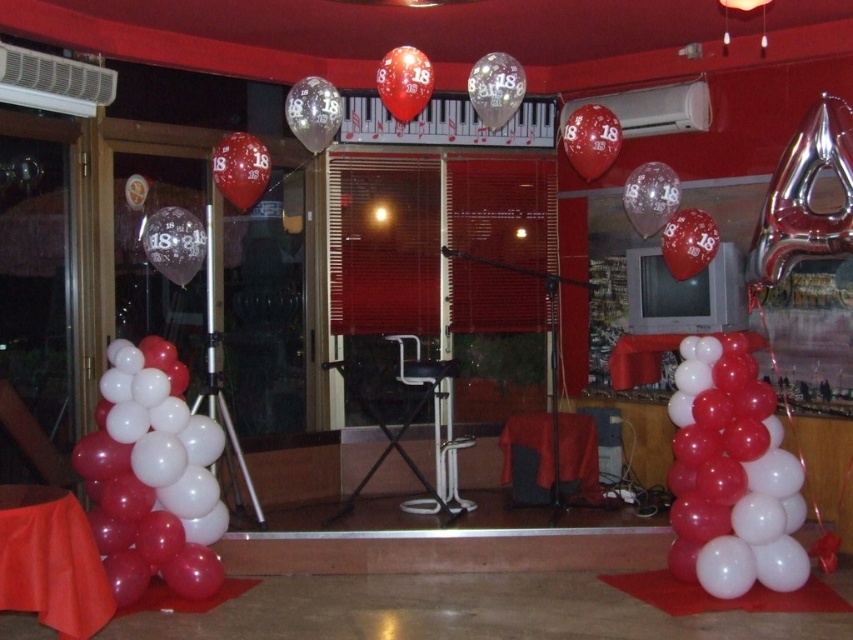
Is point (602, 170) positioned behind point (387, 52)?

No.

Locate an element on the screen. The width and height of the screenshot is (853, 640). shiny metallic balloon at upper right is located at coordinates (590, 140).

Describe the element at coordinates (590, 140) in the screenshot. The width and height of the screenshot is (853, 640). I see `shiny metallic balloon at upper right` at that location.

Find the location of a particular element. This screenshot has height=640, width=853. shiny metallic balloon at upper right is located at coordinates (590, 140).

Can you confirm if transparent glossy balloon at center is positioned to the right of transparent glittery balloon at upper center?

In fact, transparent glossy balloon at center is to the left of transparent glittery balloon at upper center.

Where is `transparent glossy balloon at center`? The image size is (853, 640). transparent glossy balloon at center is located at coordinates (241, 168).

Who is shorter, transparent glossy balloon at center or shiny metallic balloon at center?

shiny metallic balloon at center

Between transparent glossy balloon at center and shiny metallic balloon at center, which one appears on the right side from the viewer's perspective?

shiny metallic balloon at center is more to the right.

Which is in front, point (253, 138) or point (419, 93)?

Point (419, 93) is in front.

The height and width of the screenshot is (640, 853). Find the location of `transparent glossy balloon at center`. transparent glossy balloon at center is located at coordinates (241, 168).